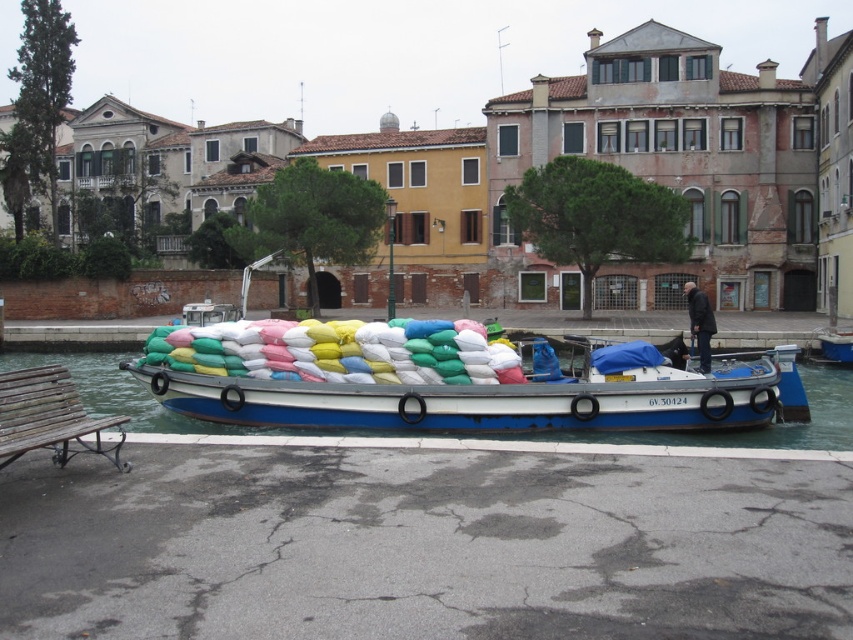
Between point (172, 387) and point (706, 330), which one is positioned in front?

Point (172, 387) is in front.

Looking at this image, does blue painted wood boat at center appear under dark gray jacket at center?

Yes.

Between point (604, 346) and point (706, 349), which one is positioned in front?

Point (604, 346)

Where is `blue painted wood boat at center`? The height and width of the screenshot is (640, 853). blue painted wood boat at center is located at coordinates (451, 388).

Based on the photo, is blue painted wood boat at center shorter than wooden bench at lower left?

Incorrect, blue painted wood boat at center's height does not fall short of wooden bench at lower left's.

Does blue painted wood boat at center appear on the right side of wooden bench at lower left?

Correct, you'll find blue painted wood boat at center to the right of wooden bench at lower left.

Where is `blue painted wood boat at center`? Image resolution: width=853 pixels, height=640 pixels. blue painted wood boat at center is located at coordinates (451, 388).

Between wooden bench at lower left and dark gray jacket at center, which one has less height?

wooden bench at lower left is shorter.

Who is more distant from viewer, (85,432) or (688,308)?

The point (688,308) is more distant.

In order to click on wooden bench at lower left in this screenshot , I will do `click(49, 417)`.